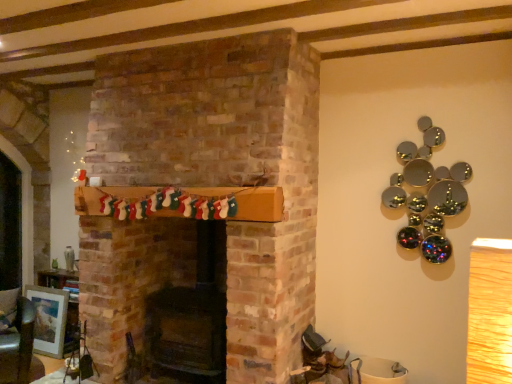
Question: Choose the correct answer: Is matte silver picture frame at lower left inside green leather armchair at lower left or outside it?

Choices:
 (A) inside
 (B) outside

Answer: (B)

Question: Does point click(32, 291) appear closer or farther from the camera than point click(0, 359)?

Choices:
 (A) farther
 (B) closer

Answer: (A)

Question: From a real-world perspective, is matte silver picture frame at lower left positioned above or below green leather armchair at lower left?

Choices:
 (A) below
 (B) above

Answer: (A)

Question: Is green leather armchair at lower left in front of or behind matte silver picture frame at lower left in the image?

Choices:
 (A) behind
 (B) front

Answer: (B)

Question: Considering the relative positions of green leather armchair at lower left and matte silver picture frame at lower left in the image provided, is green leather armchair at lower left to the left or to the right of matte silver picture frame at lower left?

Choices:
 (A) right
 (B) left

Answer: (A)

Question: From the image's perspective, is green leather armchair at lower left positioned above or below matte silver picture frame at lower left?

Choices:
 (A) below
 (B) above

Answer: (B)

Question: Considering the positions of point (14, 375) and point (61, 289), is point (14, 375) closer or farther from the camera than point (61, 289)?

Choices:
 (A) closer
 (B) farther

Answer: (A)